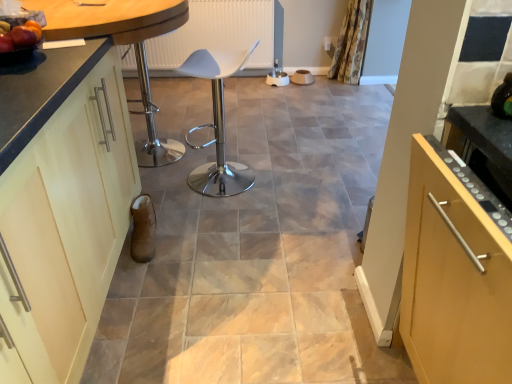
Question: Can you confirm if white plastic chair at center is shorter than floral fabric curtain at upper right?

Choices:
 (A) yes
 (B) no

Answer: (B)

Question: Is white plastic chair at center bigger than floral fabric curtain at upper right?

Choices:
 (A) yes
 (B) no

Answer: (A)

Question: Is white plastic chair at center closer to the viewer compared to floral fabric curtain at upper right?

Choices:
 (A) no
 (B) yes

Answer: (B)

Question: Is white plastic chair at center directly adjacent to floral fabric curtain at upper right?

Choices:
 (A) yes
 (B) no

Answer: (B)

Question: Is white plastic chair at center positioned beyond the bounds of floral fabric curtain at upper right?

Choices:
 (A) yes
 (B) no

Answer: (A)

Question: Is there a large distance between white plastic chair at center and floral fabric curtain at upper right?

Choices:
 (A) yes
 (B) no

Answer: (A)

Question: Can you confirm if white plastic chair at center is smaller than matte cream cabinet at left?

Choices:
 (A) yes
 (B) no

Answer: (A)

Question: Is the position of white plastic chair at center more distant than that of matte cream cabinet at left?

Choices:
 (A) yes
 (B) no

Answer: (A)

Question: Would you say white plastic chair at center is outside matte cream cabinet at left?

Choices:
 (A) yes
 (B) no

Answer: (A)

Question: Would you say matte cream cabinet at left is part of white plastic chair at center's contents?

Choices:
 (A) no
 (B) yes

Answer: (A)

Question: Is white plastic chair at center turned away from matte cream cabinet at left?

Choices:
 (A) no
 (B) yes

Answer: (A)

Question: Is white plastic chair at center oriented towards matte cream cabinet at left?

Choices:
 (A) yes
 (B) no

Answer: (B)

Question: Is white plastic chair at center facing towards matte black countertop at left?

Choices:
 (A) yes
 (B) no

Answer: (A)